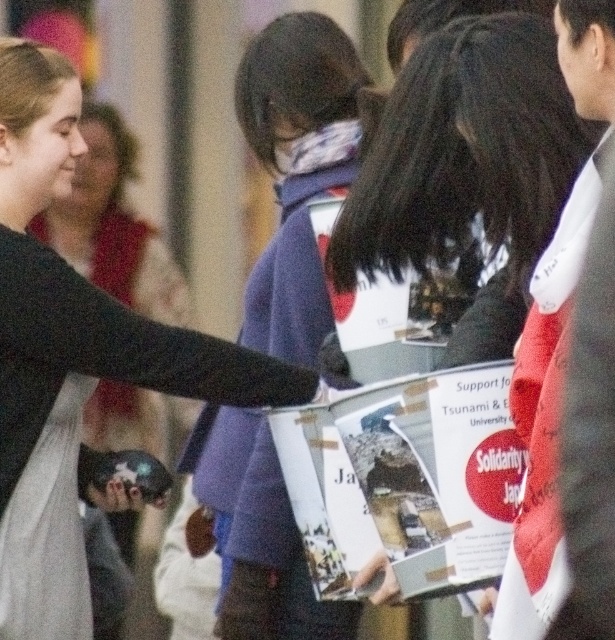
Question: Can you confirm if white paper flyer at center is positioned above purple fleece jacket at center?

Choices:
 (A) no
 (B) yes

Answer: (A)

Question: Which of the following is the closest to the observer?

Choices:
 (A) (4, 305)
 (B) (466, 340)

Answer: (B)

Question: Does white paper flyer at center appear under matte black sweater at left?

Choices:
 (A) no
 (B) yes

Answer: (B)

Question: Does matte black jacket at center have a lesser width compared to white paper flyer at center?

Choices:
 (A) no
 (B) yes

Answer: (A)

Question: Considering the real-world distances, which object is farthest from the matte black jacket at center?

Choices:
 (A) purple fleece jacket at center
 (B) matte black hand at center
 (C) matte black sweater at left

Answer: (C)

Question: Among these points, which one is farthest from the camera?

Choices:
 (A) (33, 230)
 (B) (279, 560)
 (C) (375, 593)

Answer: (A)